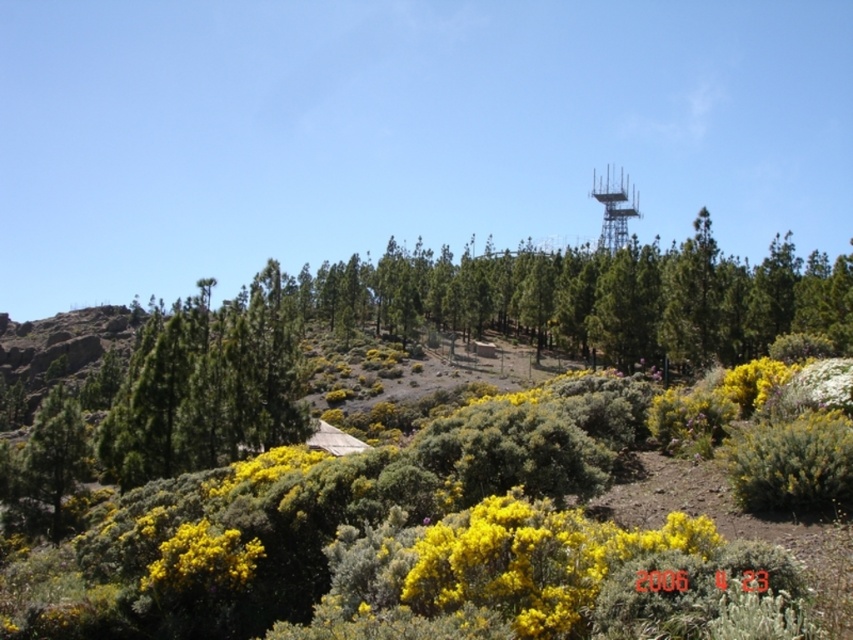
You are a gardener planning to plant a new flower bed. You have two options from the image, the yellow matte flower at center and the yellow fluffy bush at lower left. Which plant has a narrower width?

The yellow matte flower at center is thinner than the yellow fluffy bush at lower left, so it has a narrower width.

You are a landscape photographer planning to capture the yellow matte flower at center and the yellow fluffy bush at lower left in a single frame. Which of the two objects should you focus on first to ensure both are in sharp focus?

The yellow fluffy bush at lower left is larger than the yellow matte flower at center, so focusing on the yellow fluffy bush at lower left first would help ensure both are in sharp focus since it requires a closer focus distance.

You are a landscape photographer trying to capture the yellow matte flower at center and the yellow fluffy bush at lower left in a single frame. Based on their positions, which object should you adjust your camera to focus on first to ensure both are in the shot?

Since the yellow matte flower at center is to the right of the yellow fluffy bush at lower left, you should focus on the yellow fluffy bush at lower left first to ensure both are included in the frame.